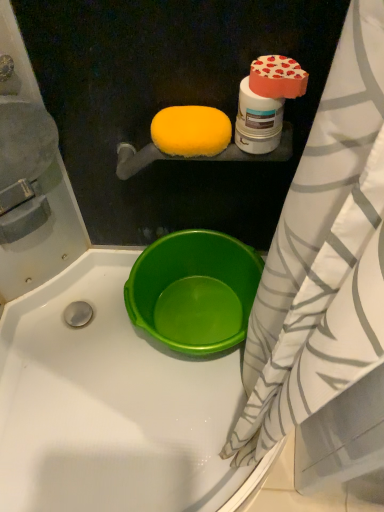
Describe the element at coordinates (191, 131) in the screenshot. I see `yellow sponge at upper center, positioned as the 1th food in back-to-front order` at that location.

What is the approximate height of smooth matte heart-shaped box at upper right, which ranks as the 2th food in back-to-front order?

It is 1.91 inches.

The image size is (384, 512). Identify the location of green plastic basin at lower center. (194, 291).

From the picture: From the image's perspective, is smooth matte heart-shaped box at upper right, marked as the 1th food in a front-to-back arrangement, located above green plastic basin at lower center?

Yes, from the image's perspective, smooth matte heart-shaped box at upper right, marked as the 1th food in a front-to-back arrangement, is above green plastic basin at lower center.

Who is shorter, smooth matte heart-shaped box at upper right, marked as the 1th food in a front-to-back arrangement, or green plastic basin at lower center?

With less height is smooth matte heart-shaped box at upper right, marked as the 1th food in a front-to-back arrangement.

Does smooth matte heart-shaped box at upper right, which is counted as the 1th food, starting from the right, have a lesser width compared to green plastic basin at lower center?

Indeed, smooth matte heart-shaped box at upper right, which is counted as the 1th food, starting from the right, has a lesser width compared to green plastic basin at lower center.

Is white striped fabric at right situated inside smooth matte heart-shaped box at upper right, which ranks as the 2th food in back-to-front order, or outside?

white striped fabric at right lies outside smooth matte heart-shaped box at upper right, which ranks as the 2th food in back-to-front order.

Is white striped fabric at right far from smooth matte heart-shaped box at upper right, which is counted as the 1th food, starting from the right?

white striped fabric at right is near smooth matte heart-shaped box at upper right, which is counted as the 1th food, starting from the right, not far away.

Is the position of white striped fabric at right more distant than that of smooth matte heart-shaped box at upper right, which is counted as the 1th food, starting from the right?

No, it is in front of smooth matte heart-shaped box at upper right, which is counted as the 1th food, starting from the right.

Consider the image. From their relative heights in the image, would you say white striped fabric at right is taller or shorter than green plastic basin at lower center?

In the image, white striped fabric at right appears to be taller than green plastic basin at lower center.

From a real-world perspective, between white striped fabric at right and green plastic basin at lower center, who is vertically lower?

green plastic basin at lower center is physically lower.

Which object is positioned more to the right, white striped fabric at right or green plastic basin at lower center?

white striped fabric at right is more to the right.

Which is in front, point (379, 40) or point (220, 296)?

The point (379, 40) is more forward.

Considering their positions, is smooth matte heart-shaped box at upper right, marked as the 1th food in a front-to-back arrangement, located in front of or behind yellow sponge at upper center, arranged as the 2th food when viewed from the right?

smooth matte heart-shaped box at upper right, marked as the 1th food in a front-to-back arrangement, is in front of yellow sponge at upper center, arranged as the 2th food when viewed from the right.

Based on the photo, which point is more distant from viewer, (258, 84) or (212, 154)?

The point (212, 154) is farther.

Based on their positions, is smooth matte heart-shaped box at upper right, the 2th food from the left, located to the left or right of yellow sponge at upper center, the second food positioned from the front?

smooth matte heart-shaped box at upper right, the 2th food from the left, is to the right of yellow sponge at upper center, the second food positioned from the front.

Are smooth matte heart-shaped box at upper right, which ranks as the 2th food in back-to-front order, and yellow sponge at upper center, arranged as the 2th food when viewed from the right, far apart?

Actually, smooth matte heart-shaped box at upper right, which ranks as the 2th food in back-to-front order, and yellow sponge at upper center, arranged as the 2th food when viewed from the right, are a little close together.

From a real-world perspective, between yellow sponge at upper center, positioned as the 1th food in back-to-front order, and smooth matte heart-shaped box at upper right, which is counted as the 1th food, starting from the right, who is vertically lower?

In real-world perspective, yellow sponge at upper center, positioned as the 1th food in back-to-front order, is lower.

Considering the sizes of yellow sponge at upper center, arranged as the first food when viewed from the left, and smooth matte heart-shaped box at upper right, marked as the 1th food in a front-to-back arrangement, in the image, is yellow sponge at upper center, arranged as the first food when viewed from the left, wider or thinner than smooth matte heart-shaped box at upper right, marked as the 1th food in a front-to-back arrangement,?

Clearly, yellow sponge at upper center, arranged as the first food when viewed from the left, has more width compared to smooth matte heart-shaped box at upper right, marked as the 1th food in a front-to-back arrangement.

Can we say yellow sponge at upper center, arranged as the 2th food when viewed from the right, lies outside smooth matte heart-shaped box at upper right, which ranks as the 2th food in back-to-front order?

Yes.

Relative to smooth matte heart-shaped box at upper right, marked as the 1th food in a front-to-back arrangement, is yellow sponge at upper center, the second food positioned from the front, in front or behind?

Clearly, yellow sponge at upper center, the second food positioned from the front, is behind smooth matte heart-shaped box at upper right, marked as the 1th food in a front-to-back arrangement.

Considering the relative sizes of green plastic basin at lower center and yellow sponge at upper center, arranged as the first food when viewed from the left, in the image provided, is green plastic basin at lower center thinner than yellow sponge at upper center, arranged as the first food when viewed from the left,?

No, green plastic basin at lower center is not thinner than yellow sponge at upper center, arranged as the first food when viewed from the left.

In order to click on basin on the right of yellow sponge at upper center, arranged as the first food when viewed from the left in this screenshot , I will do `click(194, 291)`.

Does green plastic basin at lower center touch yellow sponge at upper center, arranged as the first food when viewed from the left?

No, green plastic basin at lower center is not making contact with yellow sponge at upper center, arranged as the first food when viewed from the left.

Looking at this image, from the image's perspective, is green plastic basin at lower center positioned above or below yellow sponge at upper center, positioned as the 1th food in back-to-front order?

Clearly, from the image's perspective, green plastic basin at lower center is below yellow sponge at upper center, positioned as the 1th food in back-to-front order.

Can you confirm if green plastic basin at lower center is thinner than smooth matte heart-shaped box at upper right, which ranks as the 2th food in back-to-front order?

In fact, green plastic basin at lower center might be wider than smooth matte heart-shaped box at upper right, which ranks as the 2th food in back-to-front order.

Find the location of a particular element. Image resolution: width=384 pixels, height=512 pixels. food lying on the right of green plastic basin at lower center is located at coordinates (277, 77).

Is green plastic basin at lower center not close to smooth matte heart-shaped box at upper right, marked as the 1th food in a front-to-back arrangement?

Actually, green plastic basin at lower center and smooth matte heart-shaped box at upper right, marked as the 1th food in a front-to-back arrangement, are a little close together.

I want to click on basin below the smooth matte heart-shaped box at upper right, marked as the 1th food in a front-to-back arrangement (from the image's perspective), so click(x=194, y=291).

This screenshot has width=384, height=512. I want to click on curtain on the right of the smooth matte heart-shaped box at upper right, which ranks as the 2th food in back-to-front order, so click(323, 255).

Which object lies nearer to the anchor point yellow sponge at upper center, positioned as the 1th food in back-to-front order, smooth matte heart-shaped box at upper right, which ranks as the 2th food in back-to-front order, or green plastic basin at lower center?

The object closer to yellow sponge at upper center, positioned as the 1th food in back-to-front order, is smooth matte heart-shaped box at upper right, which ranks as the 2th food in back-to-front order.

When comparing their distances from green plastic basin at lower center, does yellow sponge at upper center, arranged as the 2th food when viewed from the right, or smooth matte heart-shaped box at upper right, which is counted as the 1th food, starting from the right, seem further?

Among the two, smooth matte heart-shaped box at upper right, which is counted as the 1th food, starting from the right, is located further to green plastic basin at lower center.

Considering their positions, is green plastic basin at lower center positioned further to smooth matte heart-shaped box at upper right, which is counted as the 1th food, starting from the right, than yellow sponge at upper center, the second food positioned from the front?

green plastic basin at lower center is further to smooth matte heart-shaped box at upper right, which is counted as the 1th food, starting from the right.

Which object lies further to the anchor point green plastic basin at lower center, white striped fabric at right or yellow sponge at upper center, positioned as the 1th food in back-to-front order?

Among the two, yellow sponge at upper center, positioned as the 1th food in back-to-front order, is located further to green plastic basin at lower center.

Looking at this image, looking at the image, which one is located closer to yellow sponge at upper center, positioned as the 1th food in back-to-front order, white striped fabric at right or green plastic basin at lower center?

Based on the image, white striped fabric at right appears to be nearer to yellow sponge at upper center, positioned as the 1th food in back-to-front order.

Looking at the image, which one is located closer to green plastic basin at lower center, white striped fabric at right or smooth matte heart-shaped box at upper right, the 2th food from the left?

white striped fabric at right is positioned closer to the anchor green plastic basin at lower center.

Based on their spatial positions, is white striped fabric at right or green plastic basin at lower center further from smooth matte heart-shaped box at upper right, marked as the 1th food in a front-to-back arrangement?

The object further to smooth matte heart-shaped box at upper right, marked as the 1th food in a front-to-back arrangement, is green plastic basin at lower center.

When comparing their distances from yellow sponge at upper center, arranged as the first food when viewed from the left, does green plastic basin at lower center or white striped fabric at right seem further?

green plastic basin at lower center lies further to yellow sponge at upper center, arranged as the first food when viewed from the left, than the other object.

This screenshot has height=512, width=384. I want to click on food between white striped fabric at right and yellow sponge at upper center, arranged as the first food when viewed from the left, along the z-axis, so click(x=277, y=77).

The height and width of the screenshot is (512, 384). I want to click on food between smooth matte heart-shaped box at upper right, marked as the 1th food in a front-to-back arrangement, and green plastic basin at lower center in the up-down direction, so click(x=191, y=131).